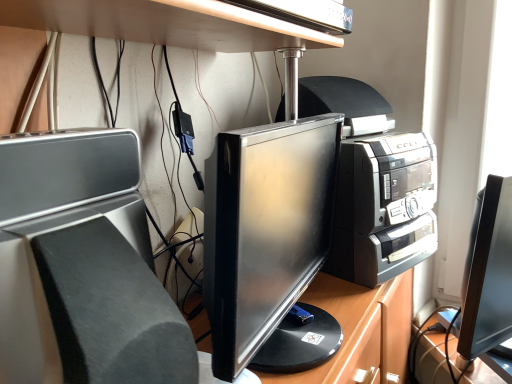
Image resolution: width=512 pixels, height=384 pixels. Describe the element at coordinates (80, 265) in the screenshot. I see `satin silver speaker at left` at that location.

Where is `satin silver speaker at left`? The width and height of the screenshot is (512, 384). satin silver speaker at left is located at coordinates (80, 265).

What do you see at coordinates (166, 23) in the screenshot? This screenshot has height=384, width=512. I see `metallic silver desk at upper center` at bounding box center [166, 23].

Where is `metallic silver desk at upper center`? The image size is (512, 384). metallic silver desk at upper center is located at coordinates (166, 23).

In order to face metallic silver desk at upper center, should I rotate leftwards or rightwards?

You should rotate left by 1.904 degrees.

Image resolution: width=512 pixels, height=384 pixels. What are the coordinates of `satin silver speaker at left` in the screenshot? It's located at (80, 265).

Based on their positions, is metallic silver desk at upper center located to the left or right of satin silver speaker at left?

In the image, metallic silver desk at upper center appears on the right side of satin silver speaker at left.

Is metallic silver desk at upper center in front of satin silver speaker at left?

That is False.

Is point (158, 3) positioned in front of point (148, 314)?

No, (158, 3) is behind (148, 314).

From the image's perspective, which one is positioned higher, metallic silver desk at upper center or satin silver speaker at left?

metallic silver desk at upper center appears higher in the image.

From a real-world perspective, who is located higher, metallic silver desk at upper center or satin silver speaker at left?

In real-world perspective, metallic silver desk at upper center is above.

Considering the relative sizes of metallic silver desk at upper center and satin silver speaker at left in the image provided, is metallic silver desk at upper center thinner than satin silver speaker at left?

Correct, the width of metallic silver desk at upper center is less than that of satin silver speaker at left.

Considering the relative sizes of metallic silver desk at upper center and satin silver speaker at left in the image provided, is metallic silver desk at upper center taller than satin silver speaker at left?

No, metallic silver desk at upper center is not taller than satin silver speaker at left.

Is metallic silver desk at upper center bigger or smaller than satin silver speaker at left?

In the image, metallic silver desk at upper center appears to be smaller than satin silver speaker at left.

Do you think metallic silver desk at upper center is within satin silver speaker at left, or outside of it?

metallic silver desk at upper center is outside satin silver speaker at left.

Is metallic silver desk at upper center beside satin silver speaker at left?

No, metallic silver desk at upper center is not in contact with satin silver speaker at left.

Could you tell me if metallic silver desk at upper center is turned towards satin silver speaker at left?

No, metallic silver desk at upper center is not facing towards satin silver speaker at left.

What's the angular difference between metallic silver desk at upper center and satin silver speaker at left's facing directions?

The angular difference between metallic silver desk at upper center and satin silver speaker at left is 3.34 degrees.

From the picture: Measure the distance between metallic silver desk at upper center and satin silver speaker at left.

They are 9.06 inches apart.

Locate an element on the screen. The height and width of the screenshot is (384, 512). home appliance in front of the metallic silver desk at upper center is located at coordinates click(x=80, y=265).

Does satin silver speaker at left appear on the right side of metallic silver desk at upper center?

No, satin silver speaker at left is not to the right of metallic silver desk at upper center.

Which is in front, satin silver speaker at left or metallic silver desk at upper center?

Positioned in front is satin silver speaker at left.

Does point (149, 355) appear closer or farther from the camera than point (82, 21)?

Point (149, 355) is positioned closer to the camera compared to point (82, 21).

From the image's perspective, is satin silver speaker at left on top of metallic silver desk at upper center?

Incorrect, from the image's perspective, satin silver speaker at left is lower than metallic silver desk at upper center.

In the scene shown: From a real-world perspective, is satin silver speaker at left over metallic silver desk at upper center?

No, from a real-world perspective, satin silver speaker at left is not over metallic silver desk at upper center

Does satin silver speaker at left have a greater width compared to metallic silver desk at upper center?

Yes.

Considering the relative sizes of satin silver speaker at left and metallic silver desk at upper center in the image provided, is satin silver speaker at left shorter than metallic silver desk at upper center?

No.

Is satin silver speaker at left smaller than metallic silver desk at upper center?

No.

Is satin silver speaker at left situated inside metallic silver desk at upper center or outside?

satin silver speaker at left lies outside metallic silver desk at upper center.

Is satin silver speaker at left touching metallic silver desk at upper center?

satin silver speaker at left and metallic silver desk at upper center are not in contact.

Looking at this image, does satin silver speaker at left turn towards metallic silver desk at upper center?

No.

How many degrees apart are the facing directions of satin silver speaker at left and metallic silver desk at upper center?

They differ by 3.34 degrees in their facing directions.

Consider the image. How distant is satin silver speaker at left from metallic silver desk at upper center?

satin silver speaker at left is 9.06 inches away from metallic silver desk at upper center.

The image size is (512, 384). In order to click on home appliance below the metallic silver desk at upper center (from the image's perspective) in this screenshot , I will do `click(80, 265)`.

Find the location of a particular element. Image resolution: width=512 pixels, height=384 pixels. home appliance in front of the metallic silver desk at upper center is located at coordinates click(80, 265).

Locate an element on the screen. The height and width of the screenshot is (384, 512). desk behind the satin silver speaker at left is located at coordinates pyautogui.click(x=166, y=23).